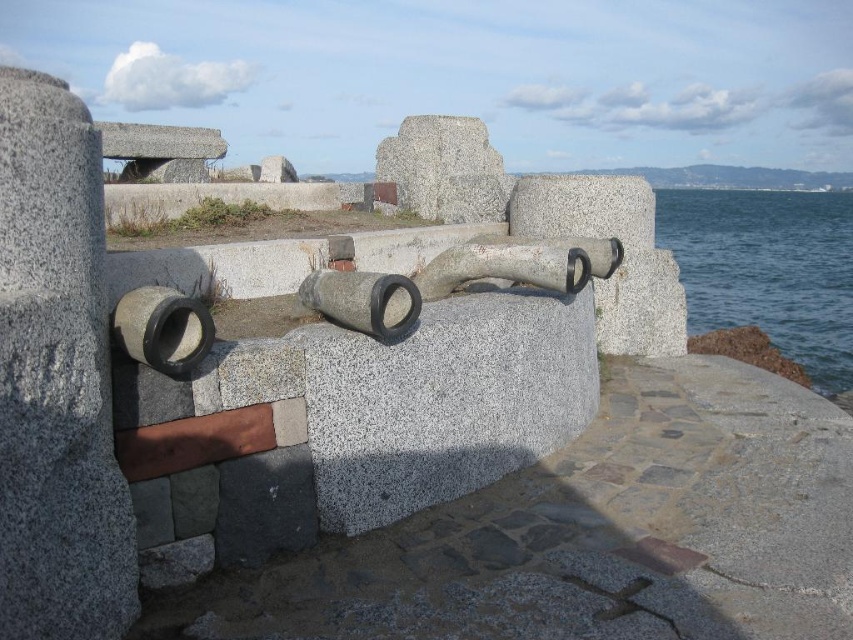
You are standing at the center of the cannons on the granite wall. Looking towards the blue water at lower right, where would you see it in terms of your field of view? Please provide coordinates as a point between 0 and 1 in both x and y axes, with the origin at the bottom left corner of your view.

The blue water at lower right is located at coordinates approximately at point (x=767, y=269) in your field of view.

You are standing on the cobblestone path in front of the gray stone cannon at center. Looking towards the blue water at lower right, where is the gray stone cannon located relative to the blue water?

The gray stone cannon at center is positioned below the blue water at lower right.

You are a tourist visiting the historical site and want to take a photo that includes both the blue water at lower right and the gray stone cannon at center. Which object should you focus on first to ensure both are in the frame?

The blue water at lower right is bigger than the gray stone cannon at center, so you should focus on the gray stone cannon at center first to ensure both fit in the frame.